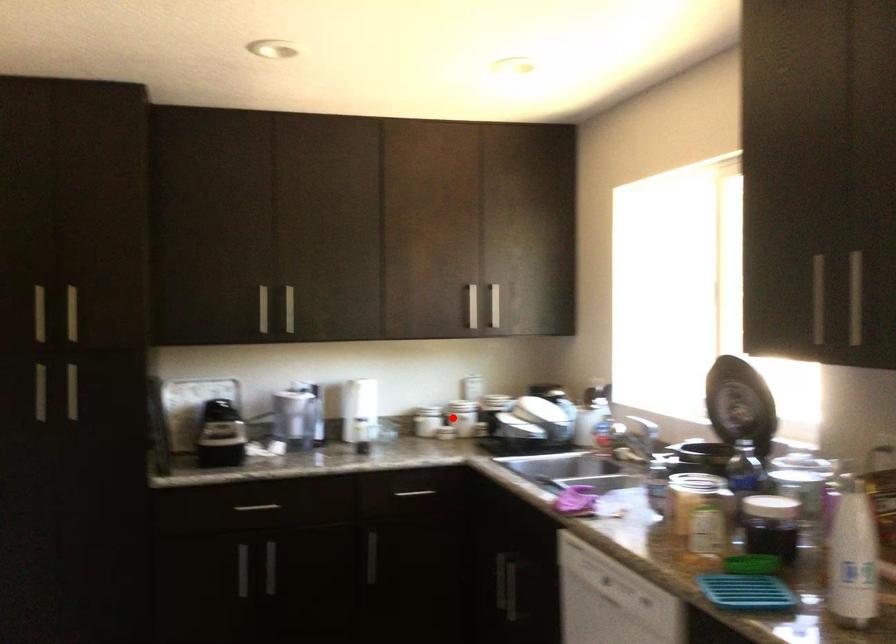
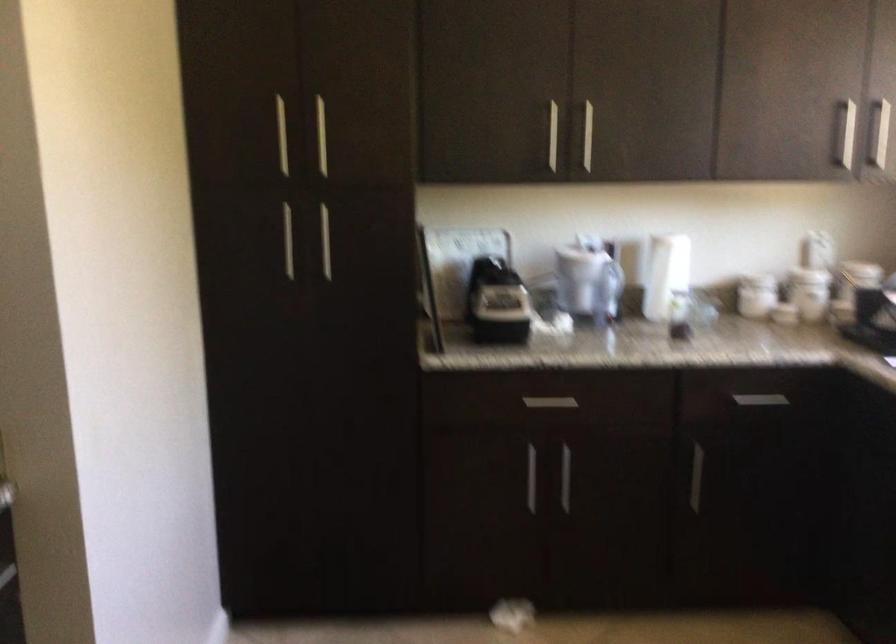
Question: I am providing you with two images of the same scene from different viewpoints. Image1 has a red point marked. In image2, the corresponding 3D location appears at what relative position? Reply with the corresponding letter.

Choices:
 (A) Closer
 (B) Farther

Answer: (A)